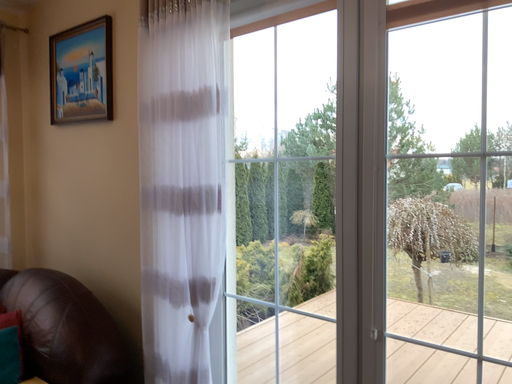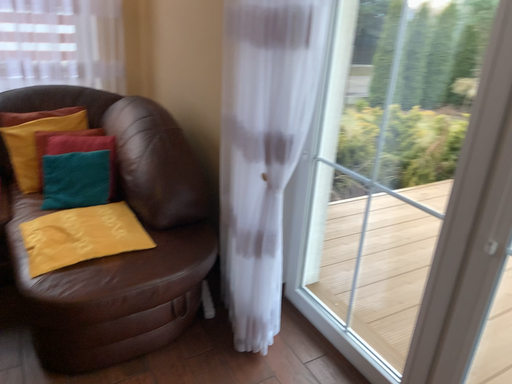
Question: Which way did the camera rotate in the video?

Choices:
 (A) rotated upward
 (B) rotated downward

Answer: (B)